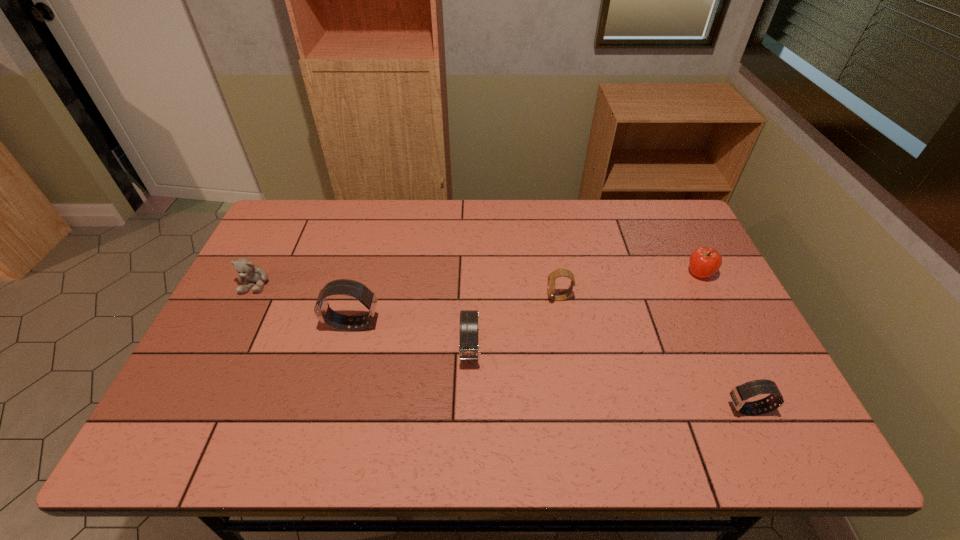
Locate an element on the screen. the leftmost watch is located at coordinates (323, 312).

The image size is (960, 540). What are the coordinates of `the fifth object from right to left` in the screenshot? It's located at (323, 312).

Where is `the second tallest watch`? Image resolution: width=960 pixels, height=540 pixels. the second tallest watch is located at coordinates (468, 348).

Where is `the third object from left to right`? the third object from left to right is located at coordinates (468, 348).

This screenshot has height=540, width=960. What are the coordinates of `the rightmost watch` in the screenshot? It's located at (739, 394).

This screenshot has width=960, height=540. Find the location of `the nearest object`. the nearest object is located at coordinates (739, 394).

The image size is (960, 540). What are the coordinates of `apple` in the screenshot? It's located at (704, 262).

Identify the location of the fourth object from left to right. Image resolution: width=960 pixels, height=540 pixels. (561, 272).

The height and width of the screenshot is (540, 960). Find the location of `the farthest watch`. the farthest watch is located at coordinates (561, 272).

Locate an element on the screen. Image resolution: width=960 pixels, height=540 pixels. the leftmost object is located at coordinates (246, 269).